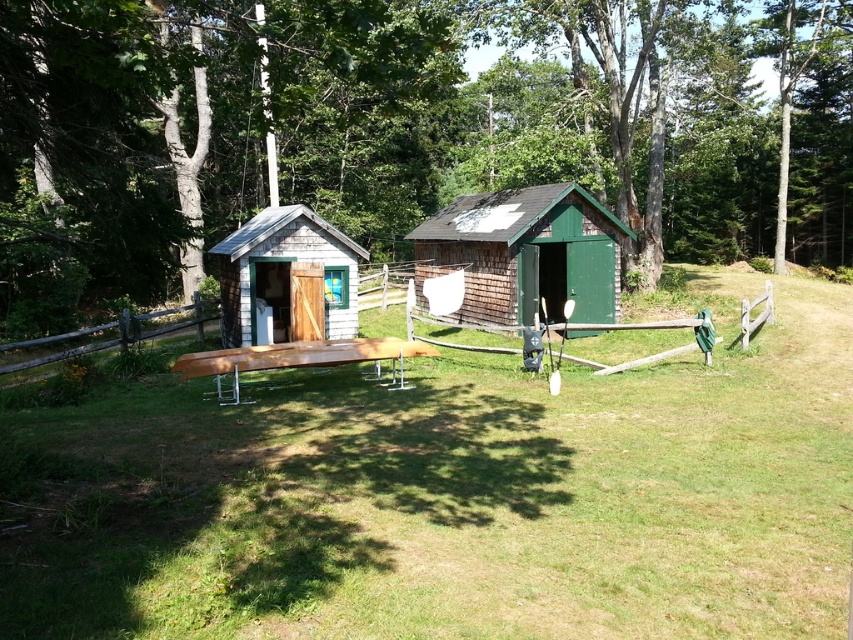
Consider the image. What is the 2D coordinate of the wooden at center?

The wooden at center is located at the 2D coordinate point of [111,339].

Please provide the coordinates of the green wood tree at upper center in the image using the coordinate system where the bottom left corner is the origin point.

The coordinates of the green wood tree at upper center are at point (407, 131).

You are planning to set up a small gathering area between the two sheds. You have a 3.5 meter long banner that you want to hang between the wooden at center and the light brown wood picnic table at center. Will the banner be long enough to stretch between them?

The distance between the wooden at center and the light brown wood picnic table at center is 3.00 meters. The banner is 3.5 meters long, which is longer than the distance between them. Therefore, the banner will be long enough to stretch between the wooden at center and the light brown wood picnic table at center.